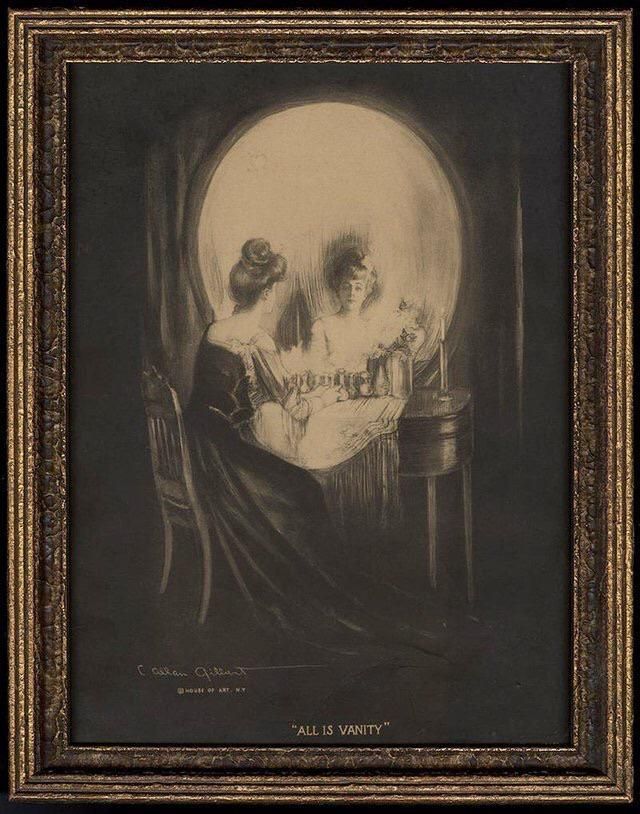
Where is `chair`? This screenshot has width=640, height=814. chair is located at coordinates (179, 461).